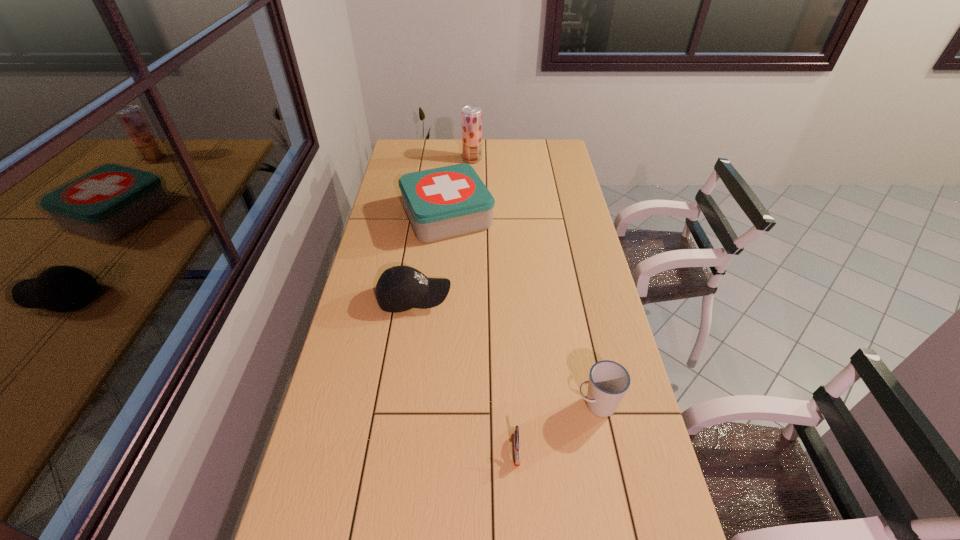
Identify which object is located as the nearest to the cup. Please provide its 2D coordinates. Your answer should be formatted as a tuple, i.e. [(x, y)], where the tuple contains the x and y coordinates of a point satisfying the conditions above.

[(516, 433)]

I want to click on object that is the third nearest to the farthest object, so click(608, 382).

Where is `free space that satisfies the following two spatial constraints: 1. with a handle on the side of the fourth farthest object; 2. on the handle side of the nearest object`? The width and height of the screenshot is (960, 540). free space that satisfies the following two spatial constraints: 1. with a handle on the side of the fourth farthest object; 2. on the handle side of the nearest object is located at coordinates point(607,449).